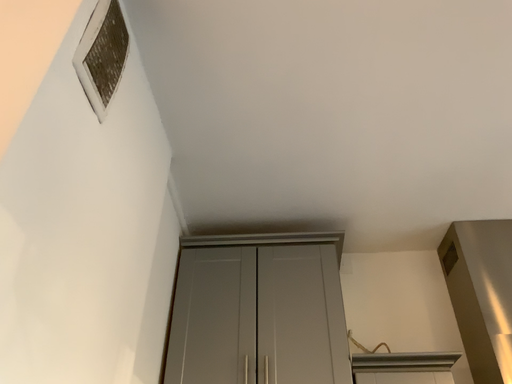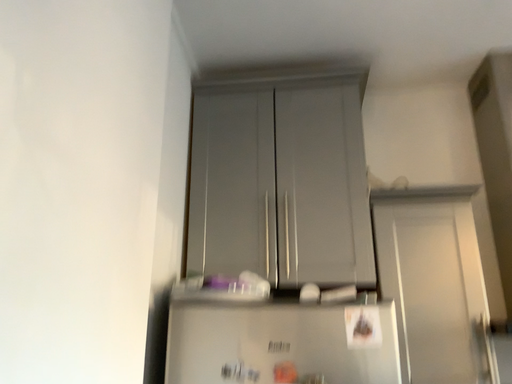
Question: Which way did the camera rotate in the video?

Choices:
 (A) rotated downward
 (B) rotated upward

Answer: (A)